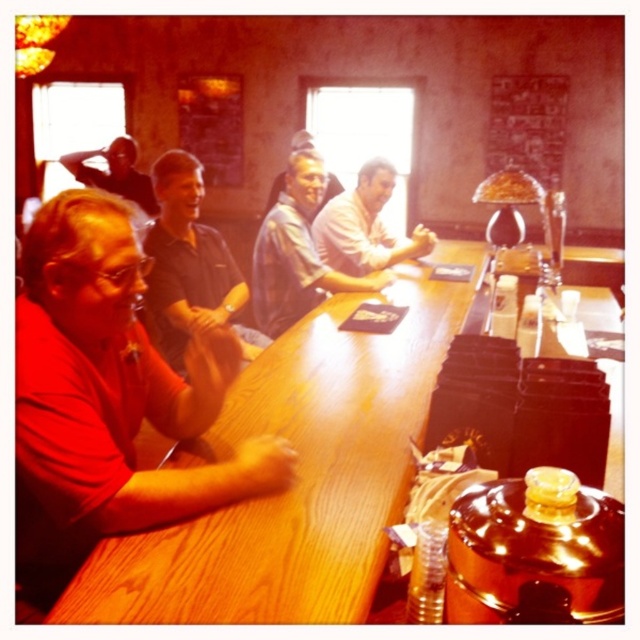
Question: Based on their relative distances, which object is nearer to the light blue shirt at center?

Choices:
 (A) white matte shirt at center
 (B) matte black shirt at upper left

Answer: (A)

Question: Which point is closer to the camera taking this photo?

Choices:
 (A) (326, 204)
 (B) (129, 180)
 (C) (147, 244)

Answer: (C)

Question: Which is nearer to the matte red shirt at left?

Choices:
 (A) white matte shirt at center
 (B) matte black shirt at upper left
 (C) light blue shirt at center

Answer: (C)

Question: Where is light blue shirt at center located in relation to matte blue shirt at center in the image?

Choices:
 (A) right
 (B) left

Answer: (A)

Question: Does white matte shirt at center have a lesser width compared to matte black shirt at upper left?

Choices:
 (A) yes
 (B) no

Answer: (A)

Question: Can you confirm if light blue shirt at center is positioned above white matte shirt at center?

Choices:
 (A) yes
 (B) no

Answer: (B)